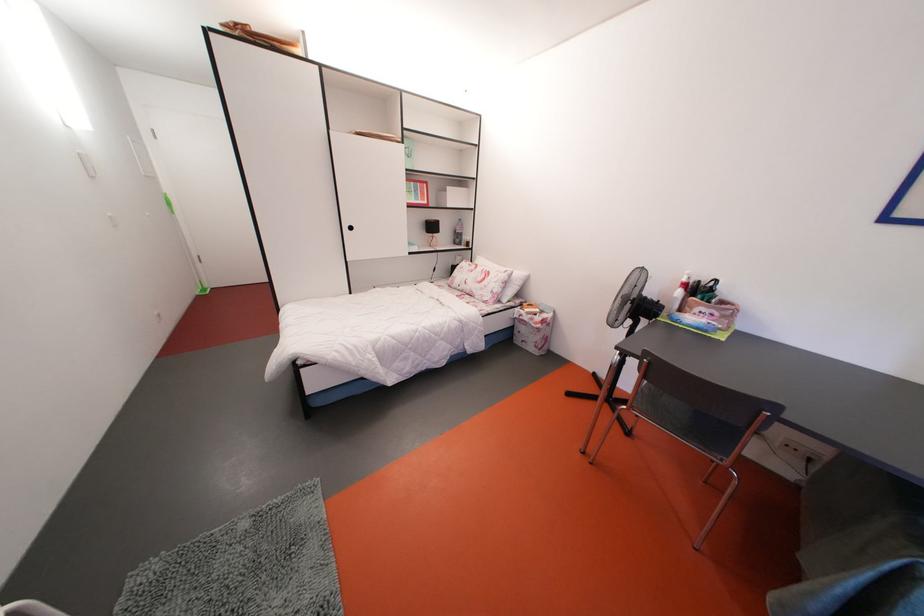
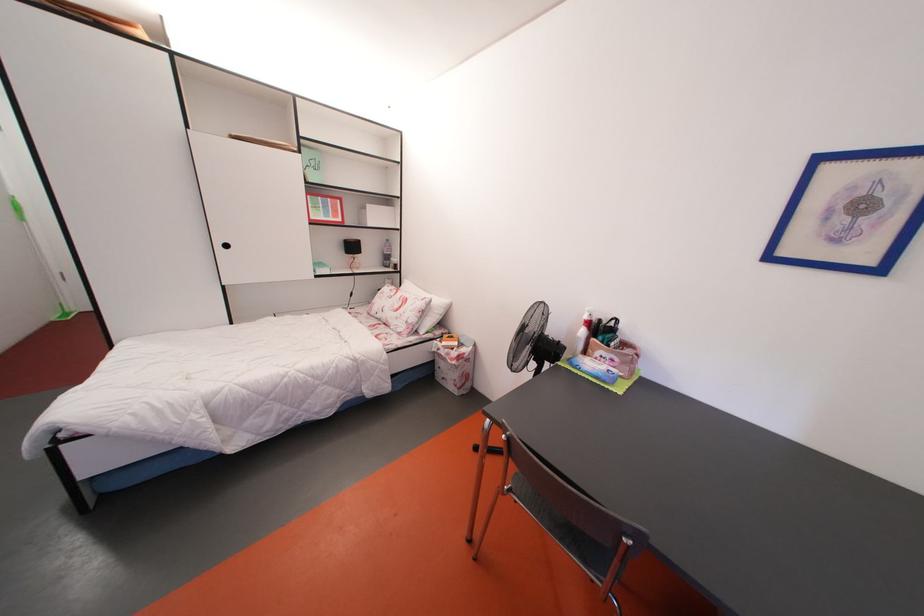
Where in the second image is the point corresponding to pixel 499 297 from the first image?

(414, 328)